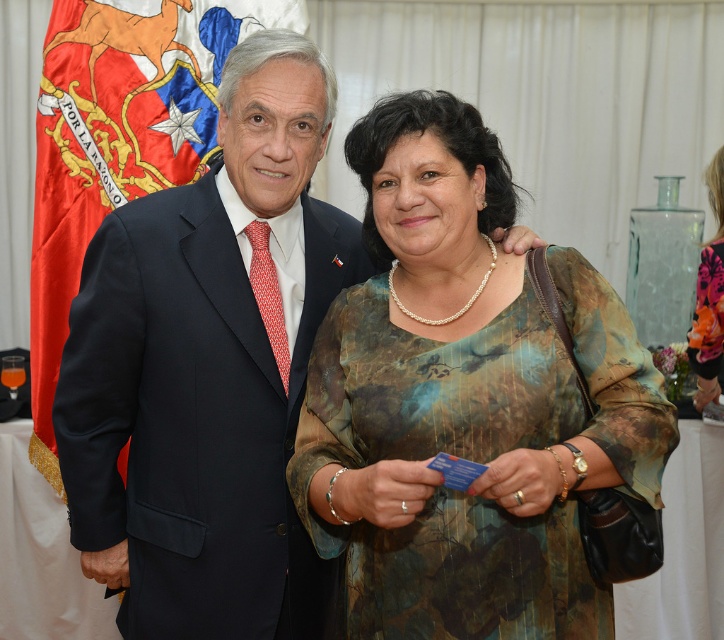
You are a photographer adjusting your camera settings. You want to focus on the dark blue suit at center and the floral silk dress at center. Which one should you adjust your focus to first to ensure both are in sharp focus?

The dark blue suit at center is closer to the viewer than the floral silk dress at center, so you should focus on the dark blue suit at center first to ensure both are in sharp focus.

You are a photographer at a formal event. You need to position two guests, the textured green dress at center and the floral silk dress at center, so that they can both fit comfortably in a group photo. The minimum recommended distance between guests for clear visibility is 1.5 meters. Can the current spacing between them allow this?

The textured green dress at center and floral silk dress at center are 1.89 meters apart, which exceeds the minimum recommended distance of 1.5 meters. Therefore, the current spacing allows them to fit comfortably in the group photo with clear visibility.

You are a photographer setting up for a group photo. You need to ensure that the dark blue suit at center and the red silk flag at left are both visible in the frame. Given that the camera has a fixed focal length, which object should you prioritize positioning closer to the camera to ensure it takes up more space in the photo?

The red silk flag at left should be positioned closer to the camera because its width is larger than the dark blue suit at center, so moving it closer will make it occupy more space in the frame while keeping both visible.